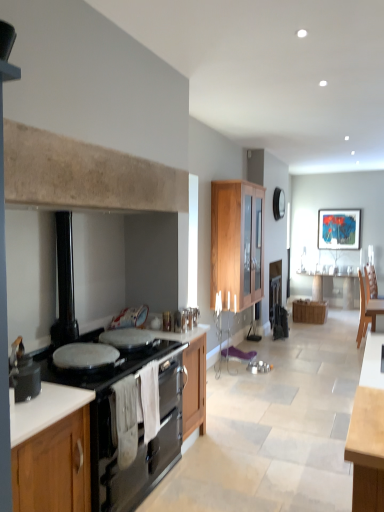
Describe the element at coordinates (367, 311) in the screenshot. The height and width of the screenshot is (512, 384). I see `wooden chair at right` at that location.

In order to face wooden cabinet at center, which ranks as the 2th cabinetry in left-to-right order, should I rotate leftwards or rightwards?

It's best to rotate right around 6.562 degrees.

Find the location of a particular element. wooden cabinet at center, the 3th cabinetry viewed from the front is located at coordinates (309, 311).

The image size is (384, 512). What do you see at coordinates (44, 409) in the screenshot? I see `white glossy countertop at lower left, the second countertop positioned from the back` at bounding box center [44, 409].

Find the location of a particular element. This screenshot has width=384, height=512. matte black pot at left is located at coordinates (23, 373).

Identify the location of wooden chair at right. (367, 311).

Considering the positions of objects white glossy countertop at lower left, marked as the first countertop in a bottom-to-top arrangement, and wooden cabinet at center, which is counted as the third cabinetry, starting from the left, in the image provided, who is more to the left, white glossy countertop at lower left, marked as the first countertop in a bottom-to-top arrangement, or wooden cabinet at center, which is counted as the third cabinetry, starting from the left,?

Positioned to the left is white glossy countertop at lower left, marked as the first countertop in a bottom-to-top arrangement.

From a real-world perspective, starting from the wooden cabinet at center, acting as the 1th cabinetry starting from the back, which countertop is the 1st one vertically above it? Please provide its 2D coordinates.

[(102, 447)]

Consider the image. Is white glossy countertop at lower left, which is counted as the first countertop, starting from the back, shorter than wooden cabinet at center, acting as the 1th cabinetry starting from the back?

No.

Based on their sizes in the image, would you say white glossy countertop at lower left, the 2th countertop from the top, is bigger or smaller than wooden cabinet at center, acting as the 1th cabinetry starting from the back?

white glossy countertop at lower left, the 2th countertop from the top, is bigger than wooden cabinet at center, acting as the 1th cabinetry starting from the back.

Is wooden table at center outside of wooden cabinet at lower left, which is the 3th cabinetry in top-to-bottom order?

wooden table at center lies outside wooden cabinet at lower left, which is the 3th cabinetry in top-to-bottom order,'s area.

Is wooden table at center thinner than wooden cabinet at lower left, which is the 3th cabinetry in top-to-bottom order?

Result: Correct, the width of wooden table at center is less than that of wooden cabinet at lower left, which is the 3th cabinetry in top-to-bottom order.

How distant is wooden table at center from wooden cabinet at lower left, marked as the 3th cabinetry in a back-to-front arrangement?

6.84 meters.

Considering the relative sizes of wooden table at center and wooden cabinet at lower left, marked as the first cabinetry in a front-to-back arrangement, in the image provided, is wooden table at center taller than wooden cabinet at lower left, marked as the first cabinetry in a front-to-back arrangement,?

No, wooden table at center is not taller than wooden cabinet at lower left, marked as the first cabinetry in a front-to-back arrangement.

This screenshot has width=384, height=512. Identify the location of pot/pan on the left of the white glossy countertop at lower left, marked as the first countertop in a bottom-to-top arrangement. (23, 373).

From a real-world perspective, is matte black pot at left over white glossy countertop at lower left, which is counted as the first countertop, starting from the back?

Yes.

Visually, is matte black pot at left positioned to the left or to the right of white glossy countertop at lower left, which is counted as the first countertop, starting from the back?

From the image, it's evident that matte black pot at left is to the left of white glossy countertop at lower left, which is counted as the first countertop, starting from the back.

Can you confirm if matte black pot at left is shorter than white glossy countertop at lower left, which is counted as the first countertop, starting from the back?

Indeed, matte black pot at left has a lesser height compared to white glossy countertop at lower left, which is counted as the first countertop, starting from the back.

Between white glossy countertop at lower left, the second countertop positioned from the back, and black matte gas stove at lower left, which one appears on the left side from the viewer's perspective?

Positioned to the left is white glossy countertop at lower left, the second countertop positioned from the back.

Considering the relative sizes of white glossy countertop at lower left, acting as the 2th countertop starting from the bottom, and black matte gas stove at lower left in the image provided, is white glossy countertop at lower left, acting as the 2th countertop starting from the bottom, thinner than black matte gas stove at lower left?

Correct, the width of white glossy countertop at lower left, acting as the 2th countertop starting from the bottom, is less than that of black matte gas stove at lower left.

Who is bigger, white glossy countertop at lower left, arranged as the first countertop when viewed from the top, or black matte gas stove at lower left?

black matte gas stove at lower left.

Is black matte gas stove at lower left located within white glossy countertop at lower left, the second countertop positioned from the back?

No, black matte gas stove at lower left is located outside of white glossy countertop at lower left, the second countertop positioned from the back.

Measure the distance from black enamel stove at left to metallic glossy picture frame at upper right.

black enamel stove at left is 5.74 meters from metallic glossy picture frame at upper right.

Considering the sizes of black enamel stove at left and metallic glossy picture frame at upper right in the image, is black enamel stove at left taller or shorter than metallic glossy picture frame at upper right?

Considering their sizes, black enamel stove at left has less height than metallic glossy picture frame at upper right.

From a real-world perspective, is black enamel stove at left positioned under metallic glossy picture frame at upper right based on gravity?

Indeed, from a real-world perspective, black enamel stove at left is positioned beneath metallic glossy picture frame at upper right.

In the scene shown: Which point is more forward, [122,348] or [320,220]?

Point [122,348]

The image size is (384, 512). There is a wooden chair at right. In order to click on the 2nd cabinetry below it (from a real-world perspective) in this screenshot , I will do `click(309, 311)`.

In the scene shown: Is wooden chair at right wider than wooden cabinet at center, placed as the first cabinetry when sorted from right to left?

In fact, wooden chair at right might be narrower than wooden cabinet at center, placed as the first cabinetry when sorted from right to left.

Is point (363, 329) closer or farther from the camera than point (326, 314)?

Point (363, 329) is positioned closer to the camera compared to point (326, 314).

Does wooden chair at right have a larger size compared to wooden cabinet at center, the 3th cabinetry viewed from the front?

Yes.

Identify the location of the 2nd cabinetry below the black matte gas stove at lower left (from a real-world perspective). Image resolution: width=384 pixels, height=512 pixels. (309, 311).

Does wooden cabinet at center, the 3th cabinetry viewed from the front, turn towards black matte gas stove at lower left?

No, wooden cabinet at center, the 3th cabinetry viewed from the front, does not turn towards black matte gas stove at lower left.

Based on the photo, which of these two, wooden cabinet at center, positioned as the second cabinetry in top-to-bottom order, or black matte gas stove at lower left, stands taller?

Standing taller between the two is wooden cabinet at center, positioned as the second cabinetry in top-to-bottom order.

You are a GUI agent. You are given a task and a screenshot of the screen. Output one action in this format:
    pyautogui.click(x=<x>, y=<y>)
    Task: Click on the countertop that is the 1st one when counting forward from the wooden cabinet at center, acting as the 1th cabinetry starting from the back
    
    Given the screenshot: What is the action you would take?
    pyautogui.click(x=102, y=447)

Locate an element on the screen. Image resolution: width=384 pixels, height=512 pixels. table below the wooden cabinet at lower left, the 1th cabinetry when ordered from left to right (from a real-world perspective) is located at coordinates (335, 289).

Which object lies further to the anchor point wooden cabinet at center, the 2th cabinetry from the bottom, wooden cabinet at center, the first cabinetry from the top, or matte black pot at left?

matte black pot at left lies further to wooden cabinet at center, the 2th cabinetry from the bottom, than the other object.

Estimate the real-world distances between objects in this image. Which object is closer to white glossy countertop at lower left, acting as the 2th countertop starting from the bottom, black matte gas stove at lower left or wooden cabinet at lower left, positioned as the first cabinetry in bottom-to-top order?

Among the two, wooden cabinet at lower left, positioned as the first cabinetry in bottom-to-top order, is located nearer to white glossy countertop at lower left, acting as the 2th countertop starting from the bottom.

Looking at the image, which one is located closer to black matte gas stove at lower left, wooden chair at right or black enamel stove at left?

black enamel stove at left lies closer to black matte gas stove at lower left than the other object.

Estimate the real-world distances between objects in this image. Which object is closer to white glossy countertop at lower left, marked as the first countertop in a bottom-to-top arrangement, wooden table at center or wooden cabinet at center, positioned as the second cabinetry in top-to-bottom order?

wooden cabinet at center, positioned as the second cabinetry in top-to-bottom order.

From the image, which object appears to be nearer to wooden cabinet at lower left, marked as the first cabinetry in a front-to-back arrangement, wooden cabinet at center, acting as the 1th cabinetry starting from the back, or wooden table at center?

wooden cabinet at center, acting as the 1th cabinetry starting from the back, is positioned closer to the anchor wooden cabinet at lower left, marked as the first cabinetry in a front-to-back arrangement.

Which object lies nearer to the anchor point black matte gas stove at lower left, wooden cabinet at center, placed as the first cabinetry when sorted from right to left, or wooden chair at right?

Among the two, wooden chair at right is located nearer to black matte gas stove at lower left.

In the scene shown: Considering their positions, is metallic glossy picture frame at upper right positioned closer to black matte gas stove at lower left than wooden cabinet at center, which is counted as the third cabinetry, starting from the left?

Among the two, wooden cabinet at center, which is counted as the third cabinetry, starting from the left, is located nearer to black matte gas stove at lower left.

Considering their positions, is wooden chair at right positioned closer to wooden cabinet at center, which is counted as the 2th cabinetry, starting from the front, than white glossy countertop at lower left, acting as the 2th countertop starting from the bottom?

Based on the image, wooden chair at right appears to be nearer to wooden cabinet at center, which is counted as the 2th cabinetry, starting from the front.

The height and width of the screenshot is (512, 384). Identify the location of gas stove between white glossy countertop at lower left, arranged as the first countertop when viewed from the top, and wooden cabinet at center, the 2th cabinetry in the right-to-left sequence, in the front-back direction. (103, 367).

Locate an element on the screen. table positioned between matte black pot at left and metallic glossy picture frame at upper right from near to far is located at coordinates (335, 289).

The image size is (384, 512). I want to click on armchair between matte black pot at left and wooden cabinet at center, positioned as the second cabinetry in top-to-bottom order, in the front-back direction, so click(367, 311).

In order to click on pot/pan between wooden cabinet at lower left, marked as the first cabinetry in a front-to-back arrangement, and wooden cabinet at center, placed as the first cabinetry when sorted from right to left, from front to back in this screenshot , I will do `click(23, 373)`.